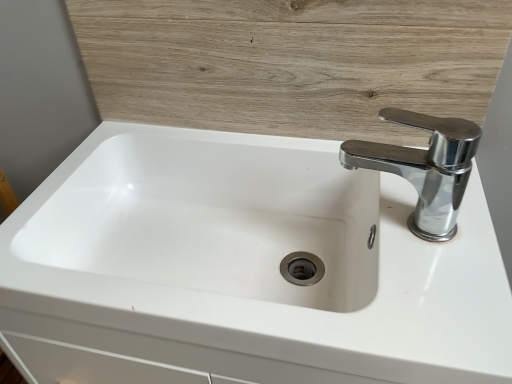
Question: Are wooden panel at upper center and white glossy sink at center making contact?

Choices:
 (A) yes
 (B) no

Answer: (B)

Question: Considering the relative sizes of wooden panel at upper center and white glossy sink at center in the image provided, is wooden panel at upper center smaller than white glossy sink at center?

Choices:
 (A) yes
 (B) no

Answer: (A)

Question: From the image's perspective, is wooden panel at upper center on white glossy sink at center?

Choices:
 (A) yes
 (B) no

Answer: (A)

Question: Does wooden panel at upper center appear on the right side of white glossy sink at center?

Choices:
 (A) yes
 (B) no

Answer: (A)

Question: Does wooden panel at upper center have a greater height compared to white glossy sink at center?

Choices:
 (A) yes
 (B) no

Answer: (B)

Question: Considering the positions of chrome metallic faucet at upper right and wooden panel at upper center in the image, is chrome metallic faucet at upper right taller or shorter than wooden panel at upper center?

Choices:
 (A) tall
 (B) short

Answer: (B)

Question: Based on their sizes in the image, would you say chrome metallic faucet at upper right is bigger or smaller than wooden panel at upper center?

Choices:
 (A) big
 (B) small

Answer: (B)

Question: Visually, is chrome metallic faucet at upper right positioned to the left or to the right of wooden panel at upper center?

Choices:
 (A) left
 (B) right

Answer: (B)

Question: From the image's perspective, is chrome metallic faucet at upper right above or below wooden panel at upper center?

Choices:
 (A) above
 (B) below

Answer: (B)

Question: Choose the correct answer: Is white glossy sink at center inside wooden panel at upper center or outside it?

Choices:
 (A) inside
 (B) outside

Answer: (B)

Question: Would you say white glossy sink at center is to the left or to the right of wooden panel at upper center in the picture?

Choices:
 (A) left
 (B) right

Answer: (A)

Question: Is white glossy sink at center taller or shorter than wooden panel at upper center?

Choices:
 (A) short
 (B) tall

Answer: (B)

Question: Does point (384, 339) appear closer or farther from the camera than point (380, 1)?

Choices:
 (A) farther
 (B) closer

Answer: (B)

Question: In terms of height, does wooden panel at upper center look taller or shorter compared to white glossy sink at center?

Choices:
 (A) tall
 (B) short

Answer: (B)

Question: Is wooden panel at upper center inside or outside of white glossy sink at center?

Choices:
 (A) inside
 (B) outside

Answer: (B)